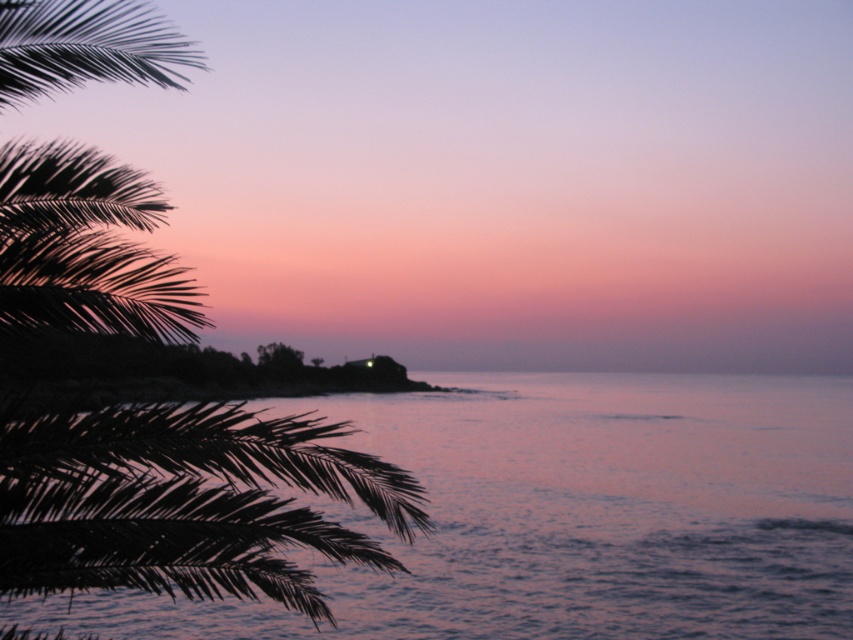
Question: Can you confirm if purple water at center is thinner than green leafy palm tree at left?

Choices:
 (A) no
 (B) yes

Answer: (A)

Question: Can you confirm if purple water at center is positioned above green leafy palm tree at left?

Choices:
 (A) no
 (B) yes

Answer: (A)

Question: From the image, what is the correct spatial relationship of purple water at center in relation to green leafy palm tree at left?

Choices:
 (A) right
 (B) left

Answer: (A)

Question: Which object appears closest to the camera in this image?

Choices:
 (A) purple water at center
 (B) green leafy palm tree at left

Answer: (B)

Question: Which of the following is the farthest from the observer?

Choices:
 (A) (407, 609)
 (B) (148, 554)

Answer: (A)

Question: Which object appears farthest from the camera in this image?

Choices:
 (A) green leafy palm tree at left
 (B) purple water at center

Answer: (B)